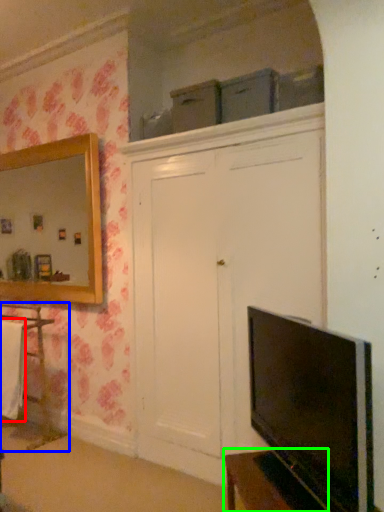
Question: Which object is positioned farthest from laundry (highlighted by a red box)? Select from cabinetry (highlighted by a blue box) and vanity (highlighted by a green box).

Choices:
 (A) cabinetry
 (B) vanity

Answer: (B)